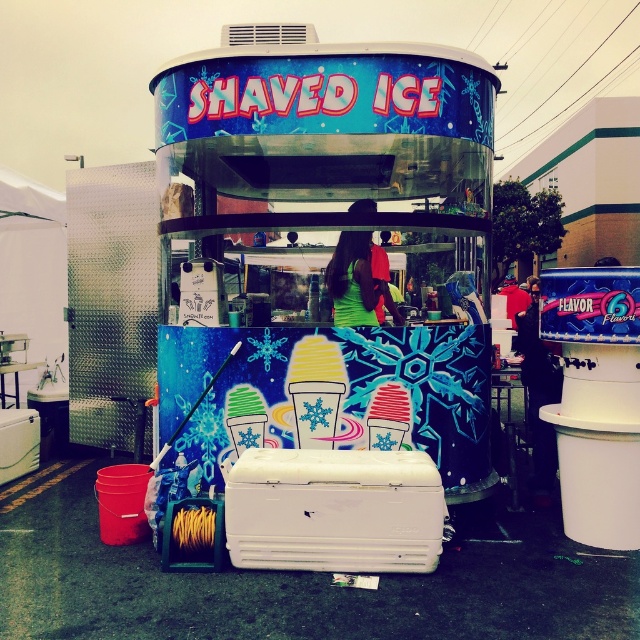
You are a customer at the shaved ice stand. You want to know which item is bigger between the shiny metallic shaved ice cart at center and the green matte shirt at center. Which one is bigger?

The shiny metallic shaved ice cart at center is larger in size than the green matte shirt at center, so the shiny metallic shaved ice cart at center is bigger.

You are standing in front of the shaved ice stand and want to know which of the two points, point [291,493] or point [349,296], is closer to you. Can you determine this based on the image?

Point [291,493] is closer to the camera than point [349,296], so it is closer to you.

You are a customer standing in front of the shaved ice stand. You see the shiny metallic shaved ice cart at center and the white plastic cooler at center. Which one is located to the right side?

The shiny metallic shaved ice cart at center is positioned on the right side of the white plastic cooler at center, so it is located to the right side.